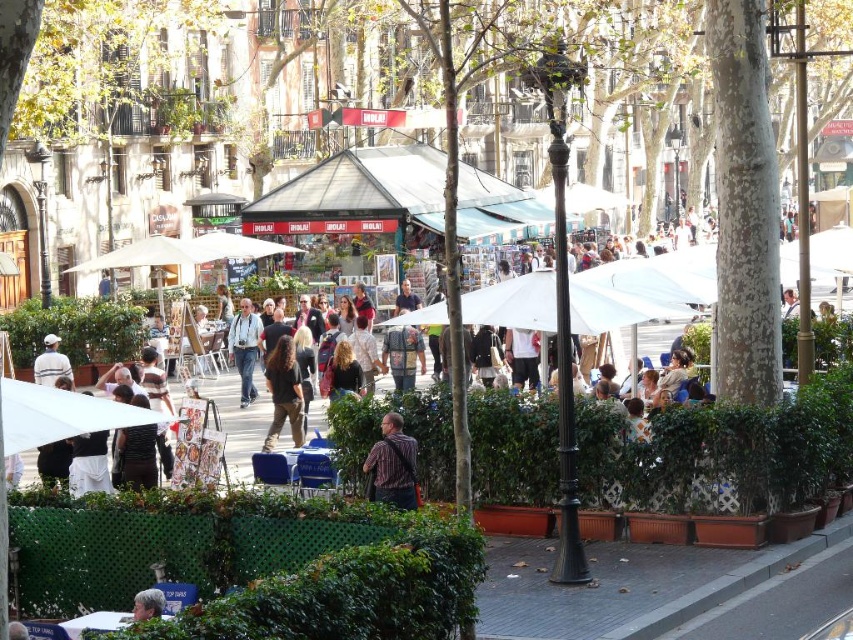
What do you see at coordinates (514, 301) in the screenshot? I see `white matte umbrella at center` at bounding box center [514, 301].

Which is below, white matte umbrella at center or striped cotton shirt at center?

Positioned lower is striped cotton shirt at center.

Who is more distant from viewer, (x=480, y=292) or (x=376, y=444)?

Positioned behind is point (x=480, y=292).

Image resolution: width=853 pixels, height=640 pixels. Find the location of `white matte umbrella at center`. white matte umbrella at center is located at coordinates (514, 301).

Who is more distant from viewer, (399, 476) or (276, 404)?

Point (276, 404)

Who is positioned more to the right, striped cotton shirt at center or dark brown hair at center?

Positioned to the right is striped cotton shirt at center.

Which is behind, point (412, 460) or point (270, 364)?

The point (270, 364) is behind.

Find the location of a particular element. This screenshot has height=640, width=853. striped cotton shirt at center is located at coordinates (393, 465).

Which is more to the left, white matte umbrella at lower left or striped cotton shirt at center?

From the viewer's perspective, white matte umbrella at lower left appears more on the left side.

Which of these two, white matte umbrella at lower left or striped cotton shirt at center, stands shorter?

With less height is white matte umbrella at lower left.

Between point (44, 444) and point (380, 461), which one is positioned in front?

Positioned in front is point (44, 444).

This screenshot has width=853, height=640. In order to click on white matte umbrella at lower left in this screenshot , I will do `click(61, 413)`.